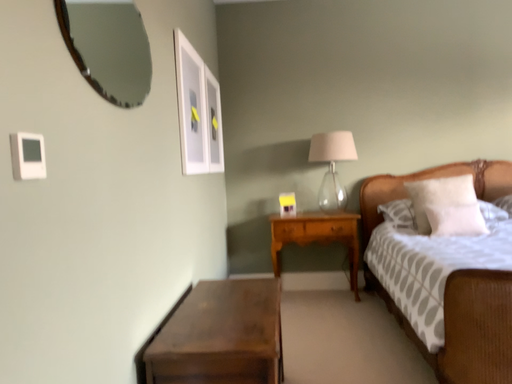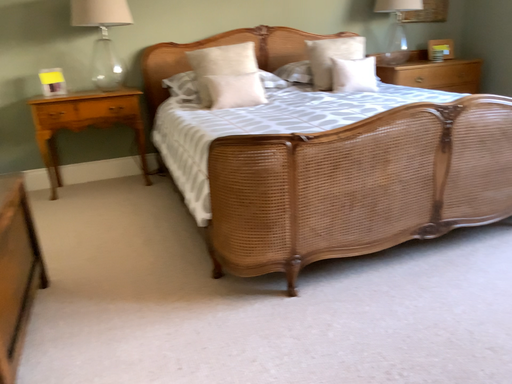
Question: Which way did the camera rotate in the video?

Choices:
 (A) rotated left
 (B) rotated right

Answer: (B)